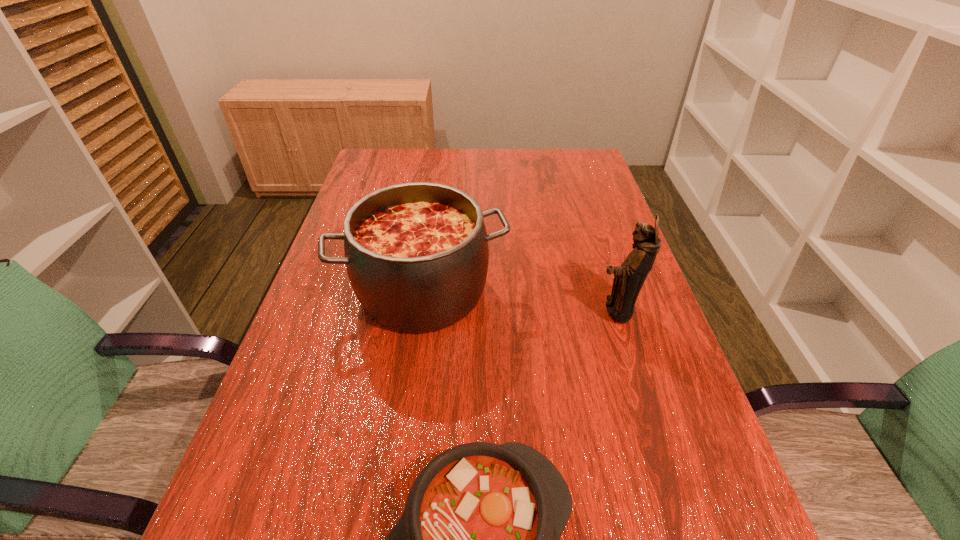
The image size is (960, 540). I want to click on the tallest object, so click(x=629, y=278).

Identify the location of figurine. Image resolution: width=960 pixels, height=540 pixels. coord(629,278).

The height and width of the screenshot is (540, 960). I want to click on the second shortest object, so click(417, 254).

Identify the location of the taller casserole. (417, 254).

The height and width of the screenshot is (540, 960). In order to click on free space located on the front-facing side of the figurine in this screenshot , I will do `click(508, 310)`.

I want to click on vacant point located on the front-facing side of the figurine, so click(558, 310).

This screenshot has height=540, width=960. Identify the location of vacant region located on the front-facing side of the figurine. (464, 310).

The height and width of the screenshot is (540, 960). What are the coordinates of `vacant space located on the right of the second shortest object` in the screenshot? It's located at (581, 291).

At what (x,y) coordinates should I click in order to perform the action: click on object located at the left edge. Please return your answer as a coordinate pair (x, y). Looking at the image, I should click on tap(417, 254).

This screenshot has height=540, width=960. Find the location of `object located in the right edge section of the desktop`. object located in the right edge section of the desktop is located at coordinates (629, 278).